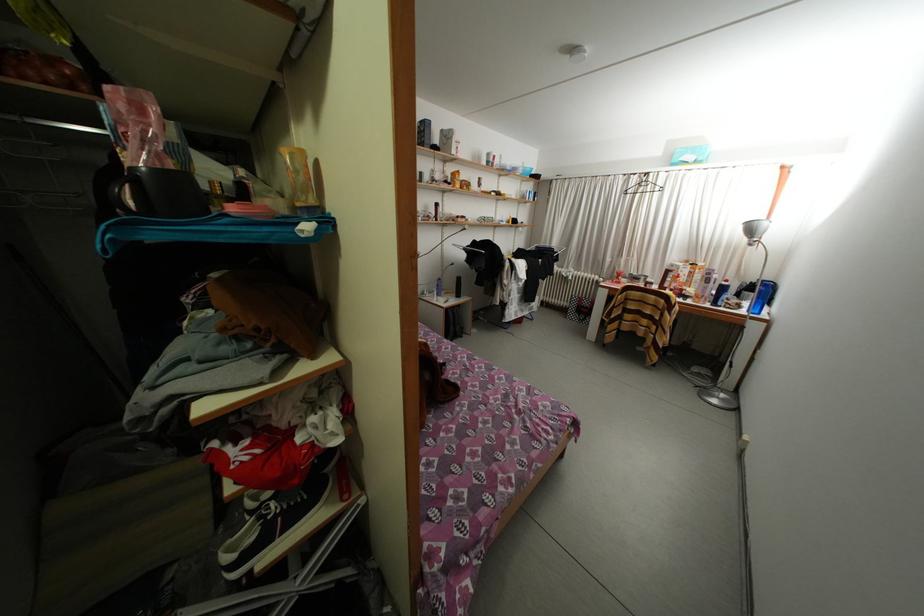
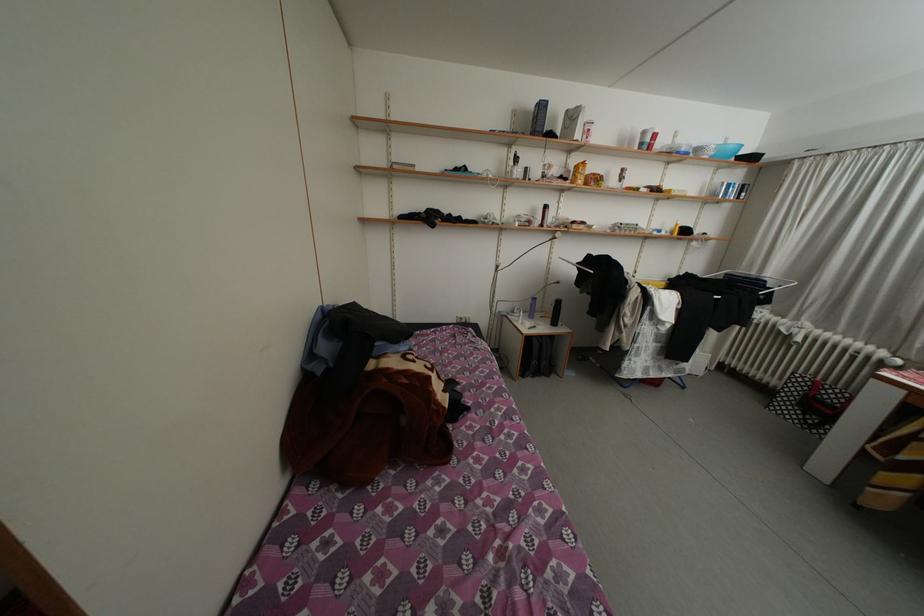
Locate, in the second image, the point that corresponds to (x=482, y=246) in the first image.

(597, 262)